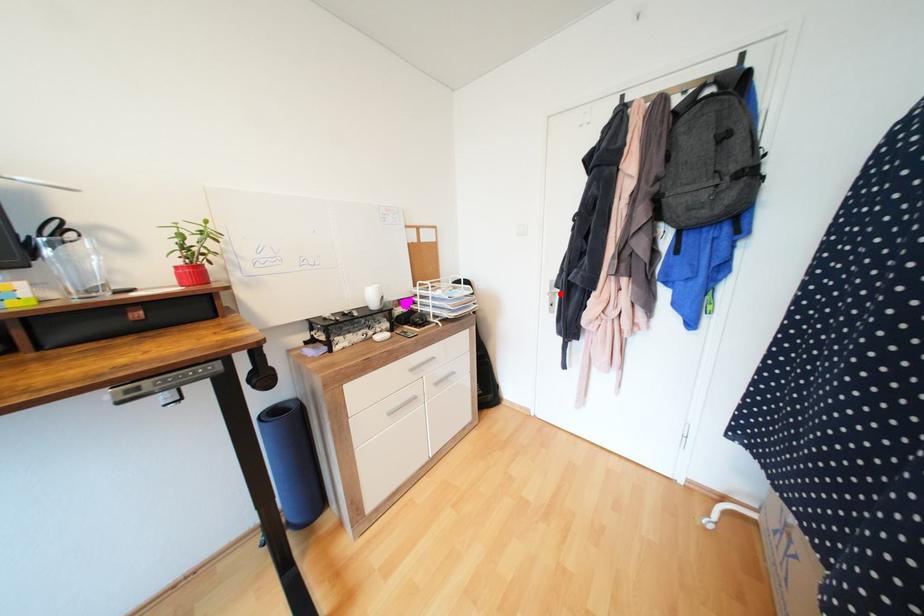
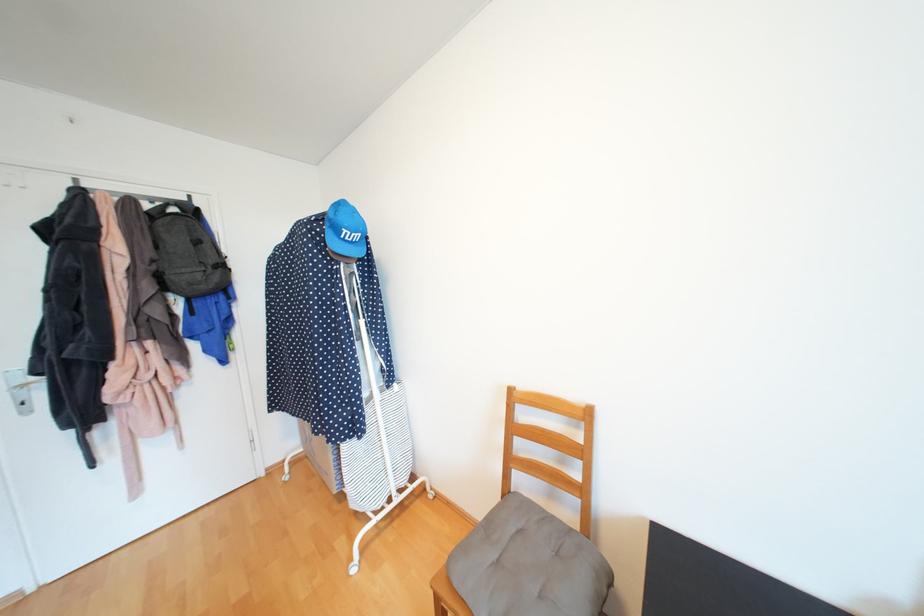
Locate, in the second image, the point that corresponds to the highlighted location in the first image.

(30, 387)